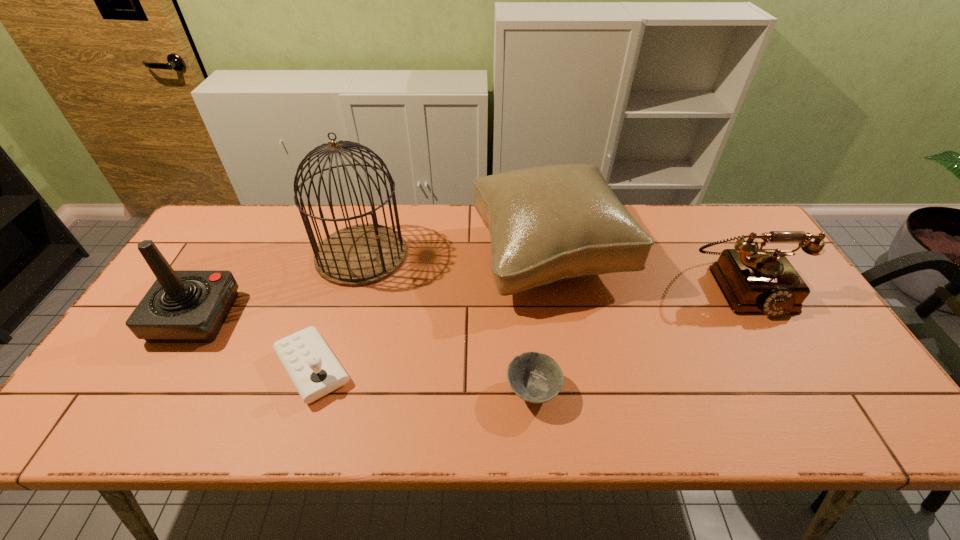
Locate an element on the screen. This screenshot has width=960, height=540. vacant space that satisfies the following two spatial constraints: 1. on the dial of the telephone; 2. on the front-facing side of the taller joystick is located at coordinates (762, 318).

In order to click on free space that satisfies the following two spatial constraints: 1. on the back side of the right joystick; 2. on the front-facing side of the taller joystick in this screenshot , I will do (329, 318).

What are the coordinates of `blank area in the image that satisfies the following two spatial constraints: 1. on the front-facing side of the shortest object; 2. on the left side of the leftmost object` in the screenshot? It's located at (152, 391).

The height and width of the screenshot is (540, 960). Find the location of `vacant position in the image that satisfies the following two spatial constraints: 1. on the back side of the cushion; 2. on the right side of the shortest object`. vacant position in the image that satisfies the following two spatial constraints: 1. on the back side of the cushion; 2. on the right side of the shortest object is located at coordinates (520, 255).